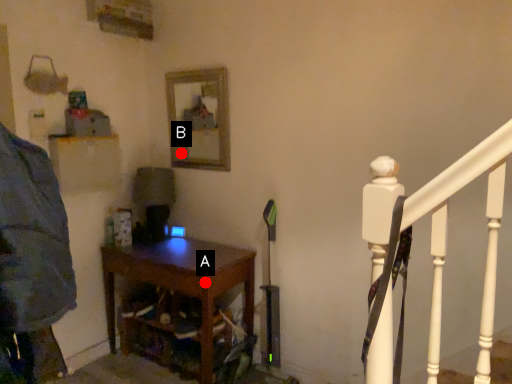
Question: Two points are circled on the image, labeled by A and B beside each circle. Which point appears closest to the camera in this image?

Choices:
 (A) A is closer
 (B) B is closer

Answer: (A)